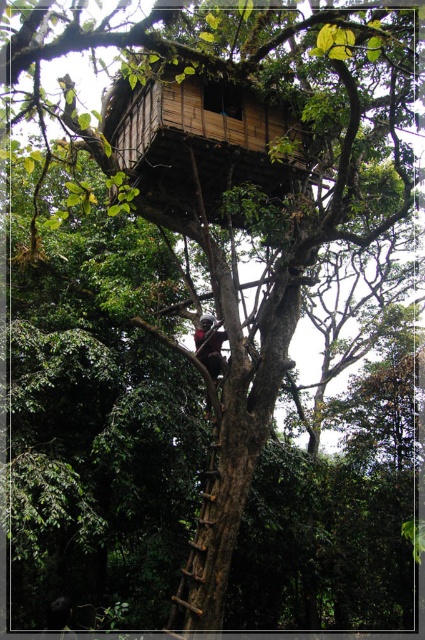
You are standing at the base of the treehouse and want to climb up to the treehouse. Which object at point [198,538] should you use?

The point [198,538] indicates the wooden textured ladder at center, so you should use the wooden textured ladder at center to climb up to the treehouse.

You are trying to reach the treehouse from the ground. There is a wooden textured ladder at center and a dark brown skin at center in your view. Which object should you climb first?

You should climb the wooden textured ladder at center first because it is located below the dark brown skin at center, which is likely the person already on the ladder or in the treehouse.